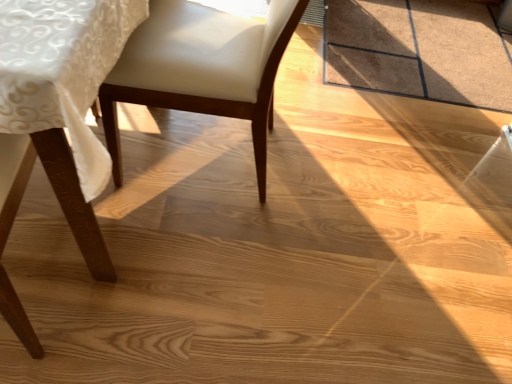
This screenshot has height=384, width=512. What do you see at coordinates (58, 105) in the screenshot?
I see `matte wood chair at lower left, the second chair positioned from the right` at bounding box center [58, 105].

Looking at this image, what is the approximate height of matte wood chair at lower left, the second chair positioned from the right?

matte wood chair at lower left, the second chair positioned from the right, is 29.72 inches in height.

Where is `matte wood chair at lower left, the second chair positioned from the right`? The height and width of the screenshot is (384, 512). matte wood chair at lower left, the second chair positioned from the right is located at coordinates (58, 105).

What do you see at coordinates (202, 69) in the screenshot?
I see `white leather chair at center, positioned as the second chair in left-to-right order` at bounding box center [202, 69].

How much space does white leather chair at center, positioned as the second chair in left-to-right order, occupy vertically?

The height of white leather chair at center, positioned as the second chair in left-to-right order, is 32.26 inches.

The width and height of the screenshot is (512, 384). In order to click on white leather chair at center, positioned as the second chair in left-to-right order in this screenshot , I will do `click(202, 69)`.

This screenshot has width=512, height=384. I want to click on matte wood chair at lower left, the second chair positioned from the right, so click(x=58, y=105).

Visually, is matte wood chair at lower left, the second chair positioned from the right, positioned to the left or to the right of white leather chair at center, the 1th chair from the right?

In the image, matte wood chair at lower left, the second chair positioned from the right, appears on the left side of white leather chair at center, the 1th chair from the right.

Is matte wood chair at lower left, the second chair positioned from the right, in front of or behind white leather chair at center, the 1th chair from the right, in the image?

In the image, matte wood chair at lower left, the second chair positioned from the right, appears in front of white leather chair at center, the 1th chair from the right.

Does point (95, 85) lie in front of point (218, 69)?

Yes, point (95, 85) is in front of point (218, 69).

From the image's perspective, would you say matte wood chair at lower left, the second chair positioned from the right, is positioned over white leather chair at center, the 1th chair from the right?

No, from the image's perspective, matte wood chair at lower left, the second chair positioned from the right, is not above white leather chair at center, the 1th chair from the right.

From a real-world perspective, which object stands above the other?

white leather chair at center, positioned as the second chair in left-to-right order, from a real-world perspective.

Which of these two, matte wood chair at lower left, the second chair positioned from the right, or white leather chair at center, the 1th chair from the right, is thinner?

white leather chair at center, the 1th chair from the right.

Can you confirm if matte wood chair at lower left, the 1th chair from the left, is shorter than white leather chair at center, positioned as the second chair in left-to-right order?

Yes.

Considering the sizes of objects matte wood chair at lower left, the second chair positioned from the right, and white leather chair at center, positioned as the second chair in left-to-right order, in the image provided, who is smaller, matte wood chair at lower left, the second chair positioned from the right, or white leather chair at center, positioned as the second chair in left-to-right order,?

With smaller size is white leather chair at center, positioned as the second chair in left-to-right order.

Is matte wood chair at lower left, the second chair positioned from the right, outside of white leather chair at center, positioned as the second chair in left-to-right order?

Absolutely, matte wood chair at lower left, the second chair positioned from the right, is external to white leather chair at center, positioned as the second chair in left-to-right order.

Are matte wood chair at lower left, the 1th chair from the left, and white leather chair at center, the 1th chair from the right, making contact?

No, matte wood chair at lower left, the 1th chair from the left, is not touching white leather chair at center, the 1th chair from the right.

Is matte wood chair at lower left, the 1th chair from the left, oriented towards white leather chair at center, positioned as the second chair in left-to-right order?

No, matte wood chair at lower left, the 1th chair from the left, is not aimed at white leather chair at center, positioned as the second chair in left-to-right order.

How many degrees apart are the facing directions of matte wood chair at lower left, the 1th chair from the left, and white leather chair at center, the 1th chair from the right?

There is a 92.1-degree angle between the facing directions of matte wood chair at lower left, the 1th chair from the left, and white leather chair at center, the 1th chair from the right.

Where is `chair in front of the white leather chair at center, positioned as the second chair in left-to-right order`? chair in front of the white leather chair at center, positioned as the second chair in left-to-right order is located at coordinates (58, 105).

Is white leather chair at center, the 1th chair from the right, to the left of matte wood chair at lower left, the second chair positioned from the right, from the viewer's perspective?

No.

Looking at this image, in the image, is white leather chair at center, positioned as the second chair in left-to-right order, positioned in front of or behind matte wood chair at lower left, the 1th chair from the left?

Visually, white leather chair at center, positioned as the second chair in left-to-right order, is located behind matte wood chair at lower left, the 1th chair from the left.

Is point (176, 9) closer to camera compared to point (86, 249)?

No, it is not.

From the image's perspective, is white leather chair at center, positioned as the second chair in left-to-right order, over matte wood chair at lower left, the 1th chair from the left?

Correct, white leather chair at center, positioned as the second chair in left-to-right order, appears higher than matte wood chair at lower left, the 1th chair from the left, in the image.

From a real-world perspective, does white leather chair at center, positioned as the second chair in left-to-right order, stand above matte wood chair at lower left, the second chair positioned from the right?

Yes, from a real-world perspective, white leather chair at center, positioned as the second chair in left-to-right order, is over matte wood chair at lower left, the second chair positioned from the right

Considering the relative sizes of white leather chair at center, the 1th chair from the right, and matte wood chair at lower left, the 1th chair from the left, in the image provided, is white leather chair at center, the 1th chair from the right, thinner than matte wood chair at lower left, the 1th chair from the left,?

Correct, the width of white leather chair at center, the 1th chair from the right, is less than that of matte wood chair at lower left, the 1th chair from the left.

Which of these two, white leather chair at center, the 1th chair from the right, or matte wood chair at lower left, the second chair positioned from the right, stands shorter?

Standing shorter between the two is matte wood chair at lower left, the second chair positioned from the right.

Considering the relative sizes of white leather chair at center, positioned as the second chair in left-to-right order, and matte wood chair at lower left, the second chair positioned from the right, in the image provided, is white leather chair at center, positioned as the second chair in left-to-right order, smaller than matte wood chair at lower left, the second chair positioned from the right,?

Indeed, white leather chair at center, positioned as the second chair in left-to-right order, has a smaller size compared to matte wood chair at lower left, the second chair positioned from the right.

Would you say white leather chair at center, the 1th chair from the right, is outside matte wood chair at lower left, the 1th chair from the left?

white leather chair at center, the 1th chair from the right, is positioned outside matte wood chair at lower left, the 1th chair from the left.

Are white leather chair at center, the 1th chair from the right, and matte wood chair at lower left, the second chair positioned from the right, far apart?

No, white leather chair at center, the 1th chair from the right, is in close proximity to matte wood chair at lower left, the second chair positioned from the right.

Is white leather chair at center, the 1th chair from the right, oriented away from matte wood chair at lower left, the second chair positioned from the right?

white leather chair at center, the 1th chair from the right, is not turned away from matte wood chair at lower left, the second chair positioned from the right.

Could you measure the distance between white leather chair at center, positioned as the second chair in left-to-right order, and matte wood chair at lower left, the 1th chair from the left?

27.64 centimeters.

I want to click on chair on the left of white leather chair at center, positioned as the second chair in left-to-right order, so click(58, 105).

Where is `chair on the left of white leather chair at center, the 1th chair from the right`? The image size is (512, 384). chair on the left of white leather chair at center, the 1th chair from the right is located at coordinates (58, 105).

Find the location of a particular element. This screenshot has height=384, width=512. chair located below the white leather chair at center, positioned as the second chair in left-to-right order (from the image's perspective) is located at coordinates (58, 105).